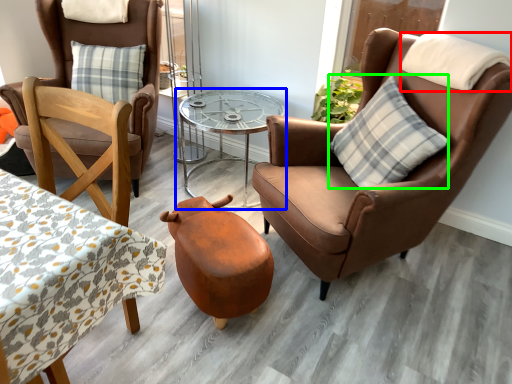
Question: Which object is positioned closest to pillow (highlighted by a red box)? Select from table (highlighted by a blue box) and pillow (highlighted by a green box).

Choices:
 (A) table
 (B) pillow

Answer: (B)